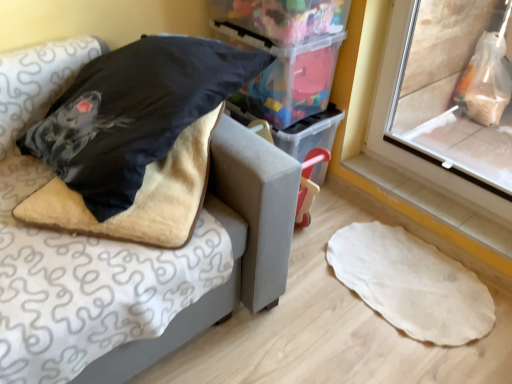
Locate an element on the screen. free area below white felt rug at lower right (from a real-world perspective) is located at coordinates (407, 280).